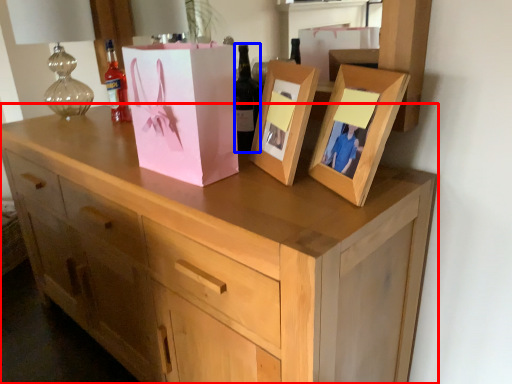
Question: Which object appears closest to the camera in this image, chest of drawers (highlighted by a red box) or bottle (highlighted by a blue box)?

Choices:
 (A) chest of drawers
 (B) bottle

Answer: (A)